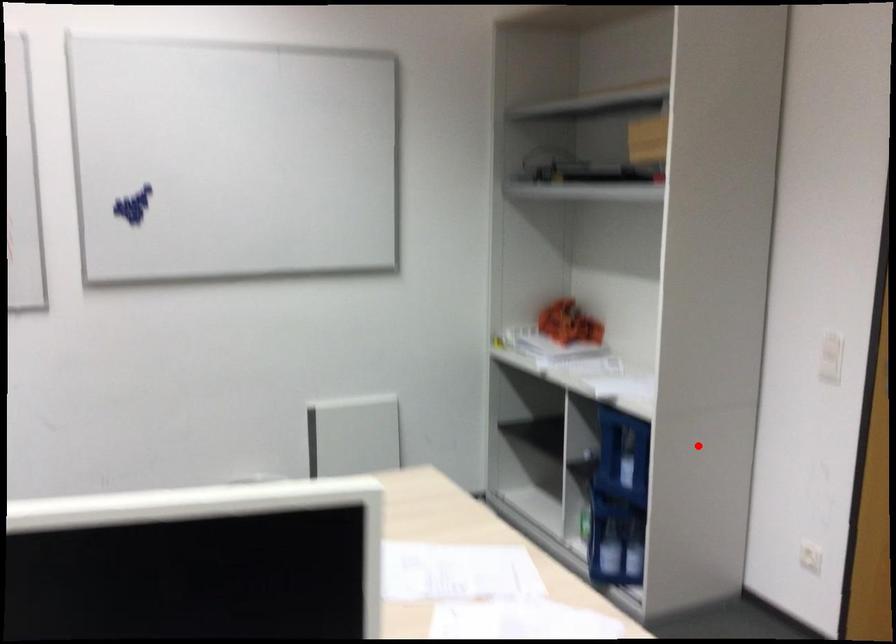
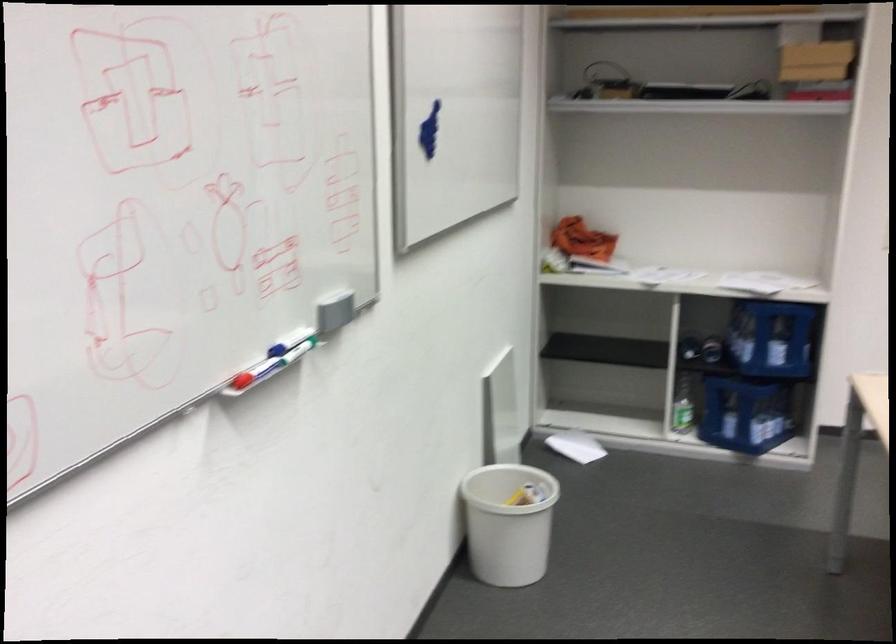
Question: I am providing you with two images of the same scene from different viewpoints. A red point is marked on the first image. At the location where the point appears in image 1, is it still visible in image 2?

Choices:
 (A) Yes
 (B) No

Answer: (A)